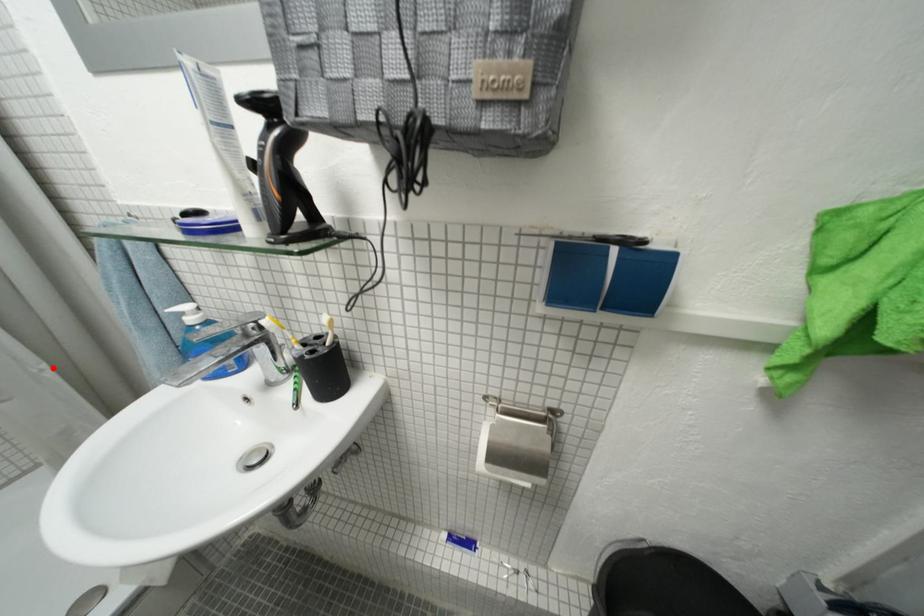
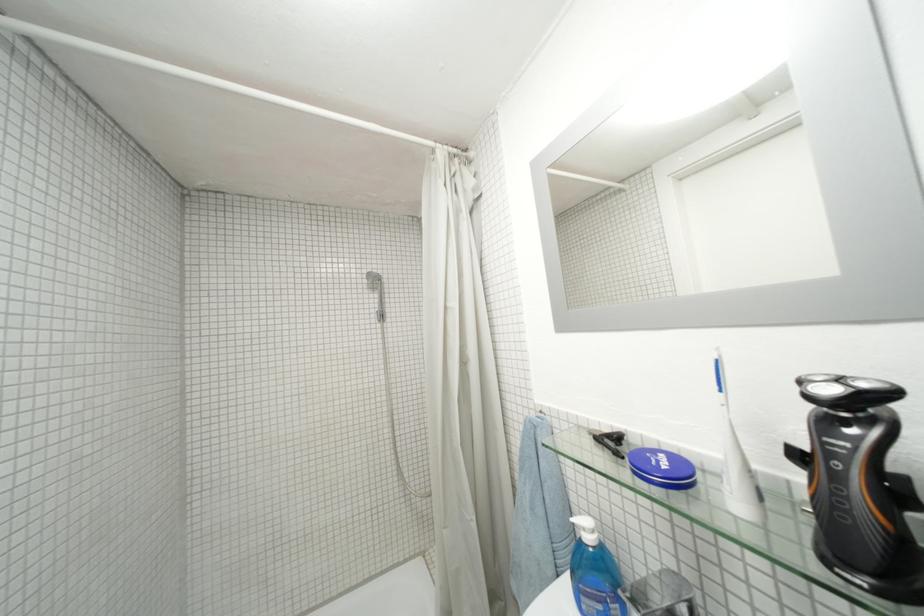
Question: A red point is marked in image1. In image2, is the corresponding 3D point closer to the camera or farther? Reply with the corresponding letter.

Choices:
 (A) The corresponding 3D point is closer.
 (B) The corresponding 3D point is farther.

Answer: (B)